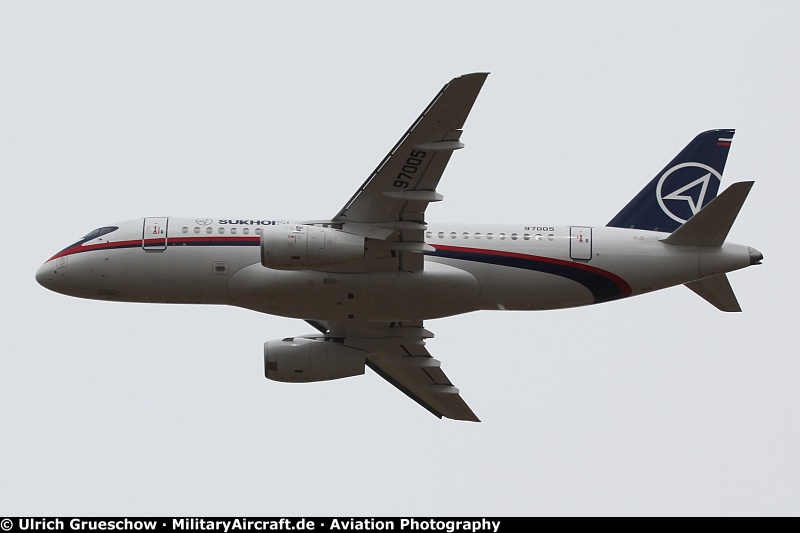
This screenshot has width=800, height=533. What are the coordinates of `doors` in the screenshot? It's located at (160, 235), (582, 244).